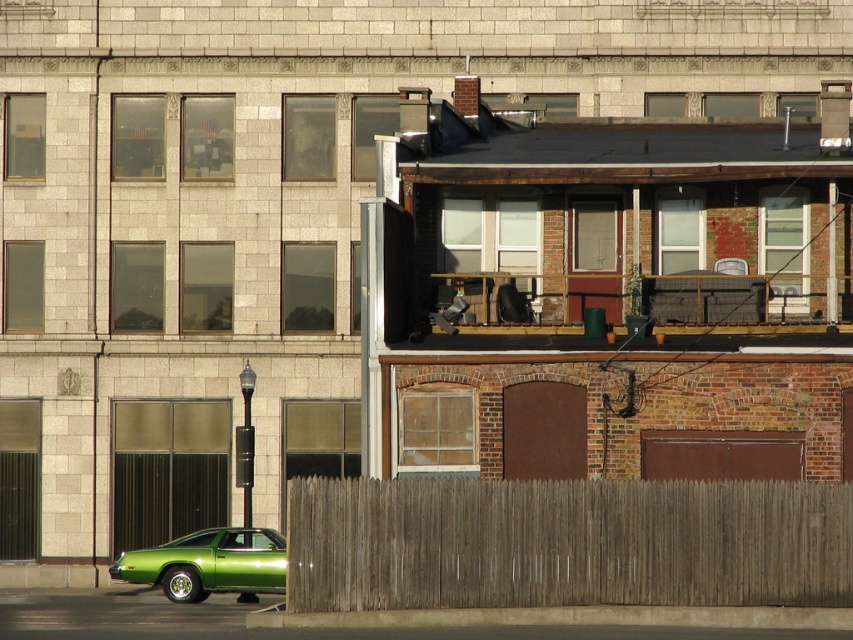
Question: Which object is farther from the camera taking this photo?

Choices:
 (A) brown wooden fence at lower center
 (B) green glossy car at lower left

Answer: (B)

Question: Which object is closer to the camera taking this photo?

Choices:
 (A) green glossy car at lower left
 (B) brown wooden fence at lower center

Answer: (B)

Question: Is brown wooden fence at lower center below green glossy car at lower left?

Choices:
 (A) no
 (B) yes

Answer: (A)

Question: Can you confirm if brown wooden fence at lower center is positioned below green glossy car at lower left?

Choices:
 (A) yes
 (B) no

Answer: (B)

Question: Does brown wooden fence at lower center appear under green glossy car at lower left?

Choices:
 (A) yes
 (B) no

Answer: (B)